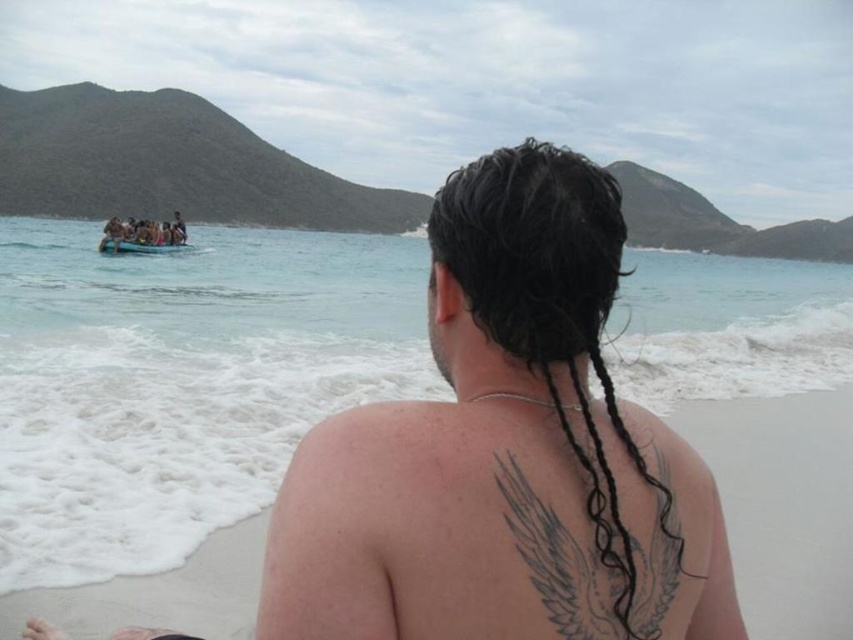
Image resolution: width=853 pixels, height=640 pixels. What are the coordinates of `clear blue water at center` in the screenshot? It's located at (181, 381).

Which is behind, point (392, 324) or point (592, 522)?

Point (392, 324)

Does point (231, 314) come in front of point (589, 616)?

No, it is not.

At what (x,y) coordinates should I click in order to perform the action: click on clear blue water at center. Please return your answer as a coordinate pair (x, y). This screenshot has width=853, height=640. Looking at the image, I should click on (181, 381).

Is dark hair at center bigger than gray ink wings at back?

Yes.

Does point (570, 358) come closer to viewer compared to point (532, 484)?

No, (570, 358) is behind (532, 484).

Which is in front, point (584, 518) or point (595, 563)?

Point (595, 563) is more forward.

Where is `dark hair at center`? Image resolution: width=853 pixels, height=640 pixels. dark hair at center is located at coordinates (503, 452).

Who is positioned more to the left, gray ink wings at back or blue plastic boat at left?

blue plastic boat at left is more to the left.

Which is in front, point (538, 529) or point (178, 248)?

Point (538, 529) is more forward.

Where is `gray ink wings at back`? This screenshot has height=640, width=853. gray ink wings at back is located at coordinates (596, 556).